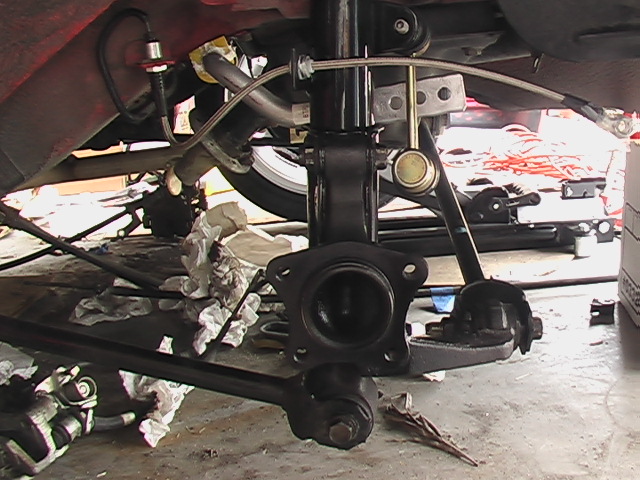
In order to click on rag in this screenshot , I will do `click(424, 450)`.